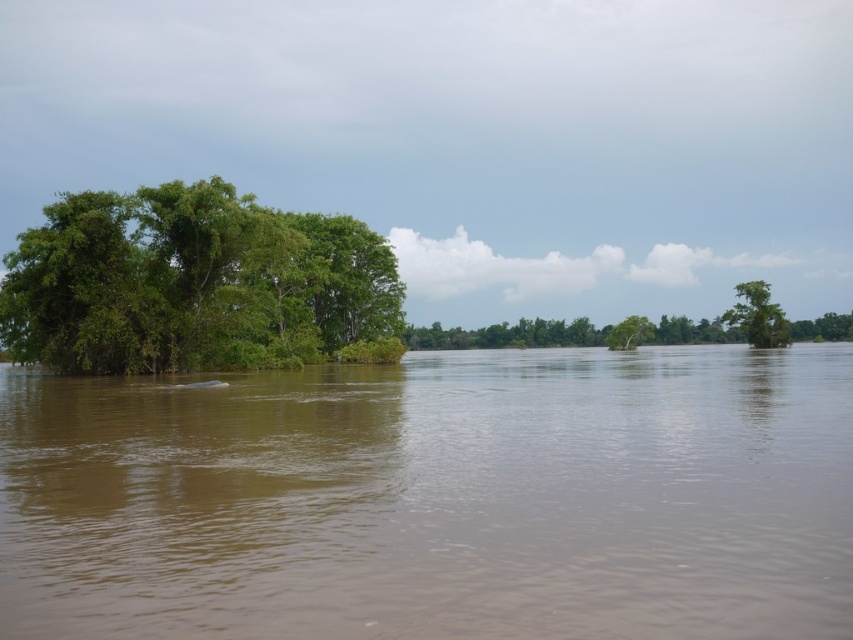
You are a kayaker planning to paddle down the river shown in the image. You see the brown muddy water at center and the green leafy tree at right. Which direction should you paddle to avoid the muddy water?

You should paddle to the right towards the green leafy tree at right to avoid the brown muddy water at center, as the brown muddy water at center is positioned under the green leafy tree at right, indicating it is located to the left of the tree.

You are a photographer standing at the riverbank. You want to capture a photo of the point at coordinates (769,292) in the image. Given that the point is 97.48 meters away from your current position, can you estimate how far you need to walk to reach it?

The point at coordinates (769,292) is 97.48 meters away from your current position, so you need to walk approximately 97.48 meters to reach it.